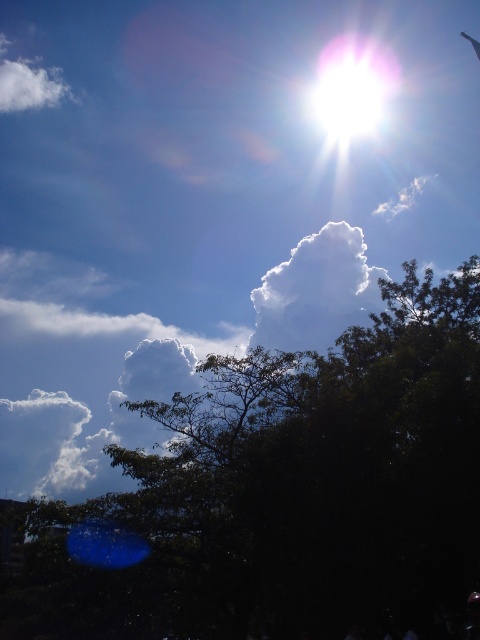
You are standing at the origin point in the image. The sun is located at the upper right corner. Where is the green leafy tree at center relative to the sun?

The green leafy tree at center is positioned at point 0.772 on the x axis and 0.598 on the y axis, which places it to the lower left of the sun in the upper right corner.

You are a photographer standing in the foreground of the scene. You want to capture a photo where the white fluffy cloud at upper center is centered in the frame. Given that the camera has a 1200x800 resolution, what are the pixel coordinates where the cloud should be placed to ensure it is perfectly centered?

The white fluffy cloud at upper center is located at point coordinates of (315, 291). To center it in a 1200x800 resolution frame, multiply the coordinates by the respective dimensions. The x coordinate is 0.455 multiplied by 1200, which equals approximately 546 pixels. The y coordinate is 0.658 multiplied by 800, resulting in approximately 526 pixels. Therefore, the cloud should be placed at pixel coordinates (479, 639) to center it in the frame.

You are an astronomer observing the sky through a telescope. You notice the green leafy tree at center and the white bright at upper center. Which object is positioned higher in the sky?

The white bright at upper center is positioned higher in the sky than the green leafy tree at center.